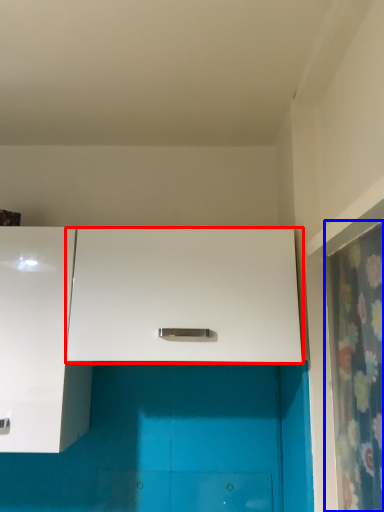
Question: Which object appears farthest to the camera in this image, cabinetry (highlighted by a red box) or shower curtain (highlighted by a blue box)?

Choices:
 (A) cabinetry
 (B) shower curtain

Answer: (A)